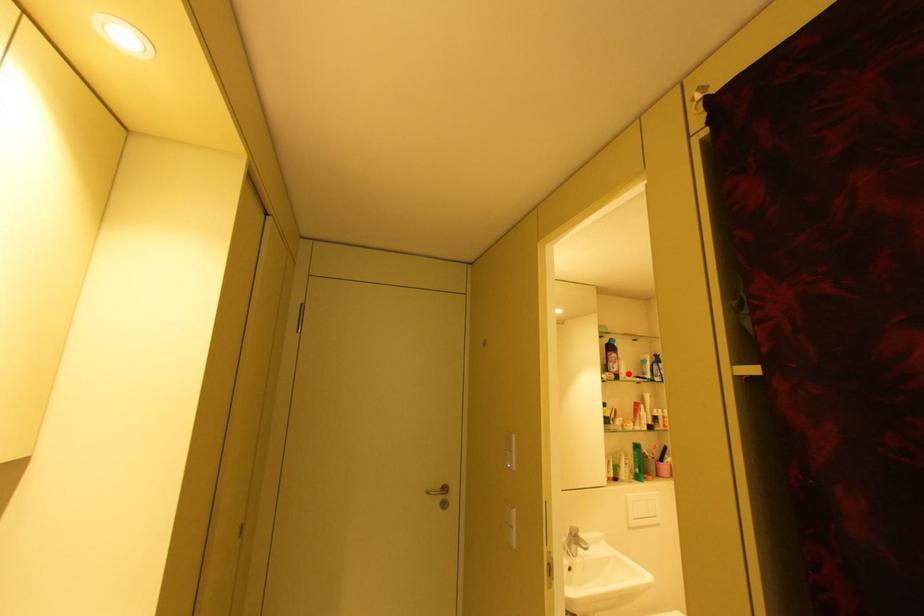
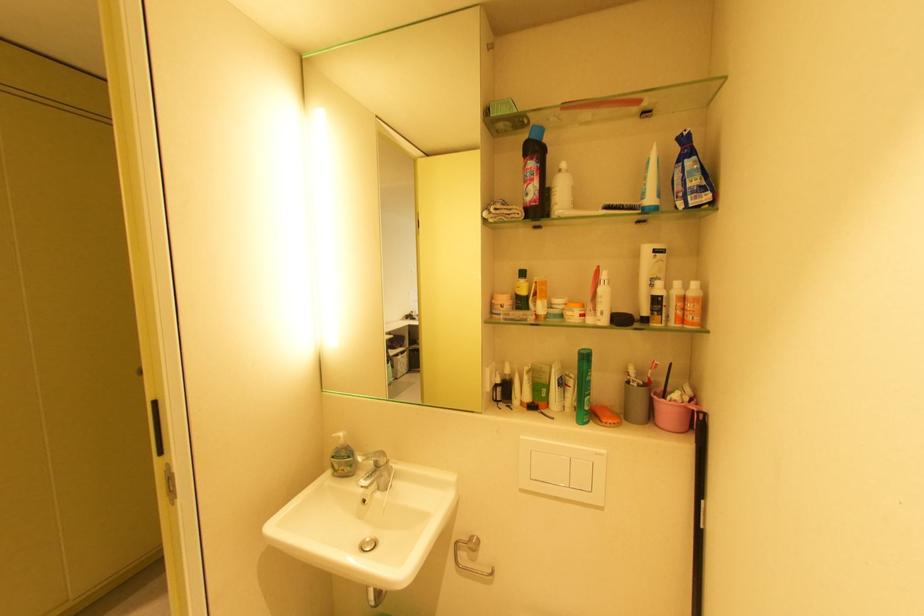
Locate, in the second image, the point that corresponds to the highlighted location in the first image.

(563, 205)